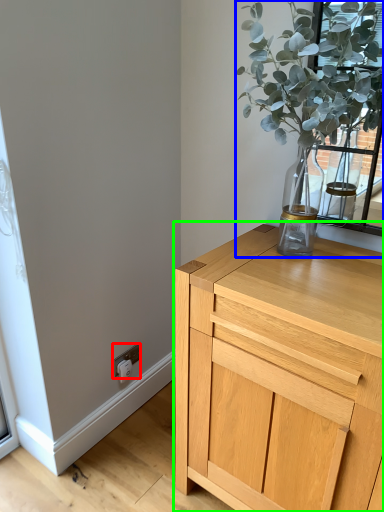
Question: Which object is positioned farthest from electric outlet (highlighted by a red box)? Select from houseplant (highlighted by a blue box) and chest of drawers (highlighted by a green box).

Choices:
 (A) houseplant
 (B) chest of drawers

Answer: (A)